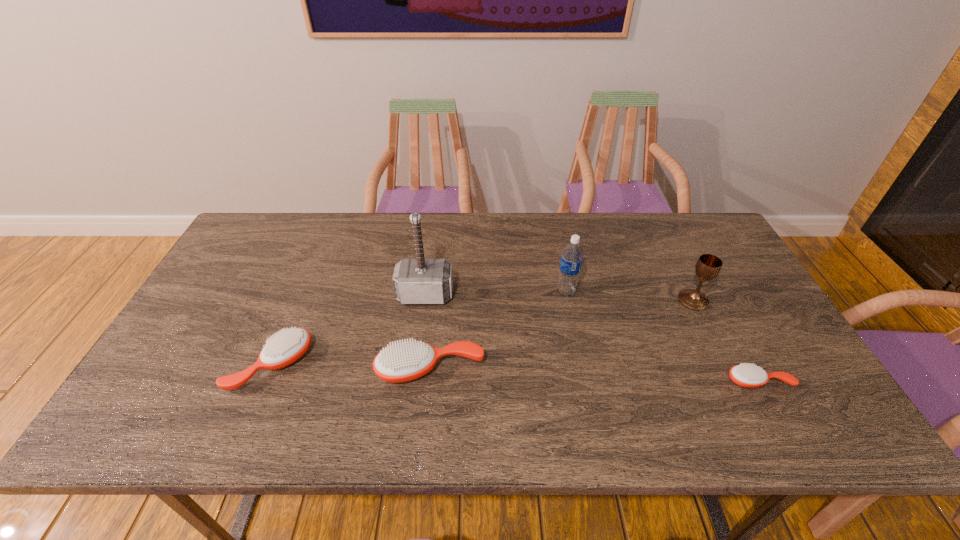
The image size is (960, 540). In order to click on free space between the leftmost object and the shortest object in this screenshot , I will do `click(515, 373)`.

Image resolution: width=960 pixels, height=540 pixels. Find the location of `vacant space that is in between the rightmost hairbrush and the second tallest object`. vacant space that is in between the rightmost hairbrush and the second tallest object is located at coordinates (662, 336).

Locate an element on the screen. Image resolution: width=960 pixels, height=540 pixels. vacant space that's between the water bottle and the chalice is located at coordinates (630, 296).

Select which object is the closest to the rightmost hairbrush. Please provide its 2D coordinates. Your answer should be formatted as a tuple, i.e. [(x, y)], where the tuple contains the x and y coordinates of a point satisfying the conditions above.

[(708, 266)]

Locate an element on the screen. The height and width of the screenshot is (540, 960). object that is the third closest to the second hairbrush from left to right is located at coordinates (572, 254).

Point out which hairbrush is positioned as the nearest to the leftmost hairbrush. Please provide its 2D coordinates. Your answer should be formatted as a tuple, i.e. [(x, y)], where the tuple contains the x and y coordinates of a point satisfying the conditions above.

[(405, 361)]

Identify which hairbrush is located as the second nearest to the fifth tallest object. Please provide its 2D coordinates. Your answer should be formatted as a tuple, i.e. [(x, y)], where the tuple contains the x and y coordinates of a point satisfying the conditions above.

[(750, 376)]

Locate an element on the screen. This screenshot has height=540, width=960. free point that satisfies the following two spatial constraints: 1. on the back side of the chalice; 2. on the left side of the second shortest hairbrush is located at coordinates (299, 300).

This screenshot has width=960, height=540. Find the location of `free region that satisfies the following two spatial constraints: 1. for striking with the head of the second hairbrush from left to right; 2. on the left side of the tallest object`. free region that satisfies the following two spatial constraints: 1. for striking with the head of the second hairbrush from left to right; 2. on the left side of the tallest object is located at coordinates (416, 370).

Find the location of a particular element. Image resolution: width=960 pixels, height=540 pixels. free spot that satisfies the following two spatial constraints: 1. for striking with the head of the tallest object; 2. on the left side of the second hairbrush from right to left is located at coordinates (416, 370).